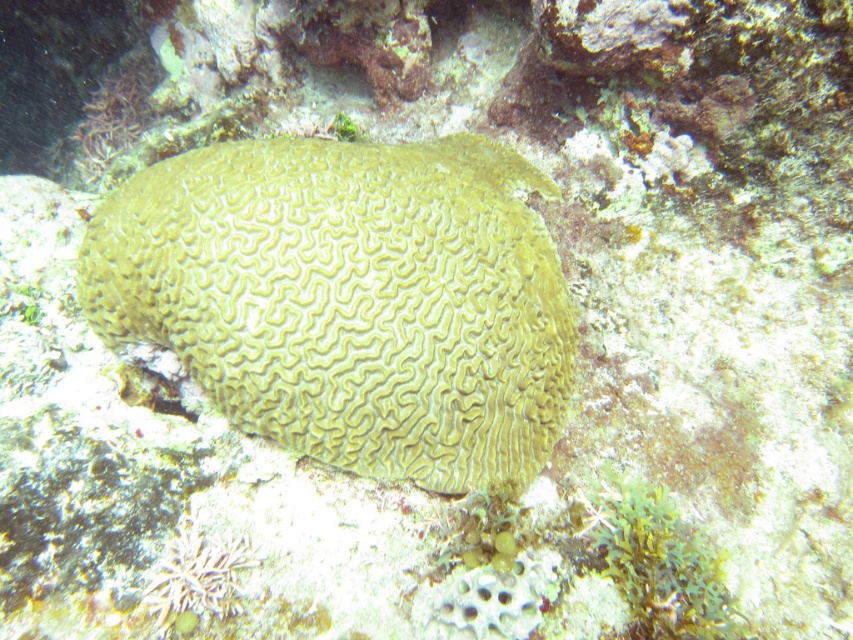
In the scene shown: You are a marine biologist observing the underwater scene. You need to determine the relative positions of the yellow brain coral at center and the green matte algae at lower right. Which object is located to the left of the other?

The yellow brain coral at center is positioned on the left side of green matte algae at lower right, so the yellow brain coral at center is to the left of the green matte algae at lower right.

You are a marine biologist studying underwater life. You observe the yellow brain coral at center and the green matte algae at lower right in the image. Which organism occupies a larger area in the scene?

The yellow brain coral at center is bigger than the green matte algae at lower right, so it occupies a larger area in the scene.

You are a marine biologist observing the underwater scene. You need to determine the relative position of the yellow brain coral at center and the green matte algae at lower right. Which one is positioned higher in the water column?

The yellow brain coral at center is located above the green matte algae at lower right, so it is positioned higher in the water column.